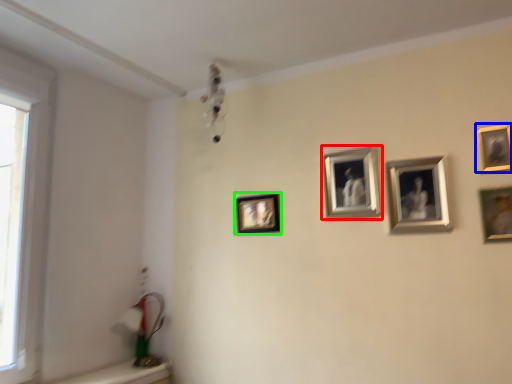
Question: Estimate the real-world distances between objects in this image. Which object is farther from picture frame (highlighted by a red box), picture frame (highlighted by a blue box) or picture frame (highlighted by a green box)?

Choices:
 (A) picture frame
 (B) picture frame

Answer: (A)